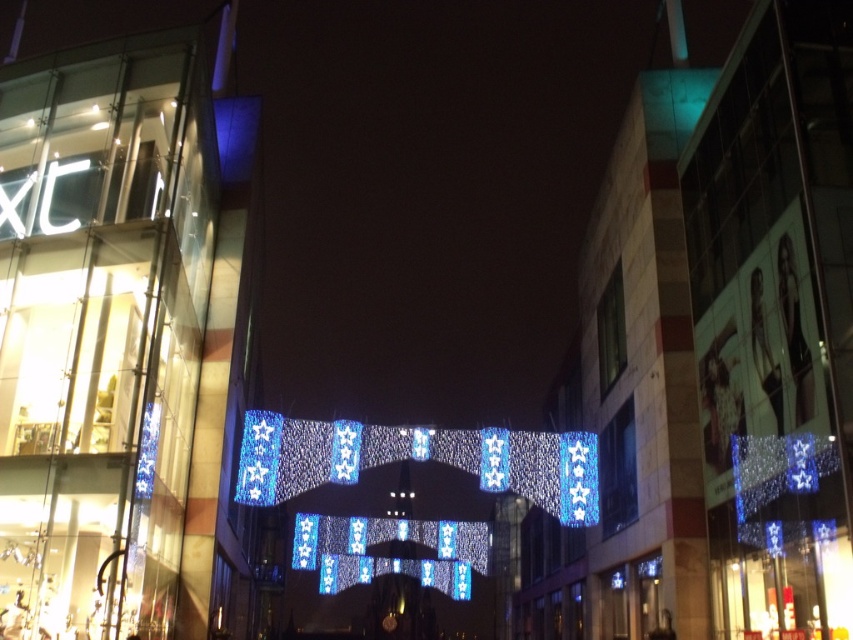
Does blue glass building at center have a lesser height compared to translucent glass mall at center?

In fact, blue glass building at center may be taller than translucent glass mall at center.

Identify the location of blue glass building at center. Image resolution: width=853 pixels, height=640 pixels. (715, 355).

Is point (695, 480) positioned in front of point (117, 76)?

Yes, it is.

Locate an element on the screen. This screenshot has width=853, height=640. blue glass building at center is located at coordinates (715, 355).